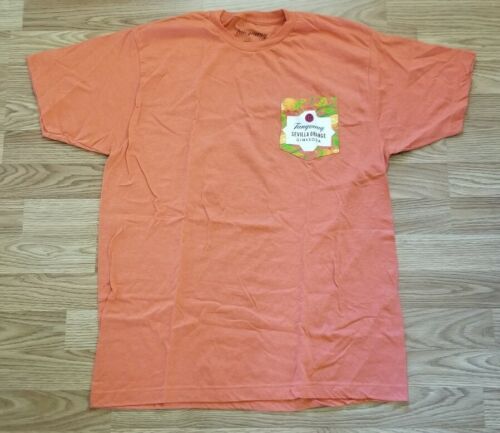
In order to click on table in this screenshot , I will do `click(455, 273)`, `click(78, 267)`.